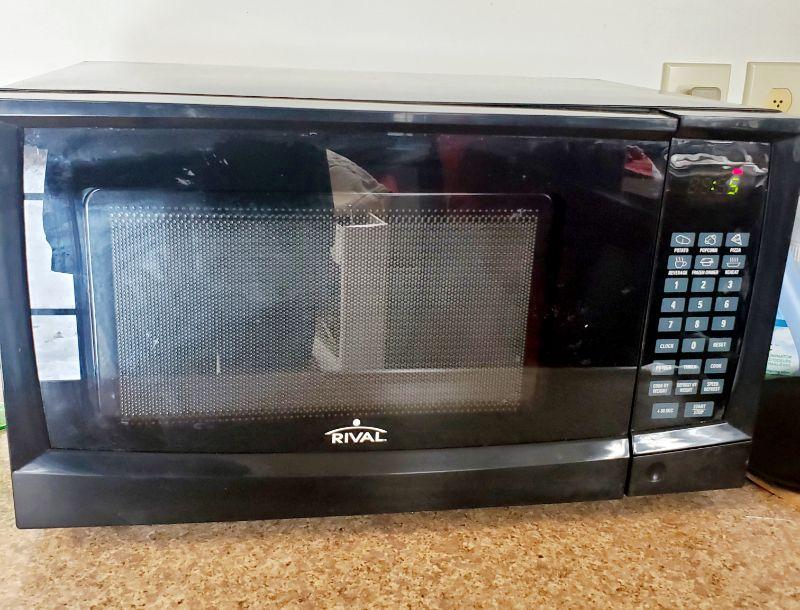
Find the location of a particular element. This screenshot has width=800, height=610. table is located at coordinates (x=614, y=493).